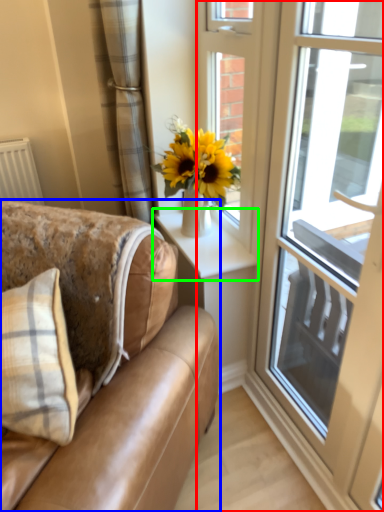
Question: Estimate the real-world distances between objects in this image. Which object is closer to window (highlighted by a red box), studio couch (highlighted by a blue box) or window sill (highlighted by a green box)?

Choices:
 (A) studio couch
 (B) window sill

Answer: (B)